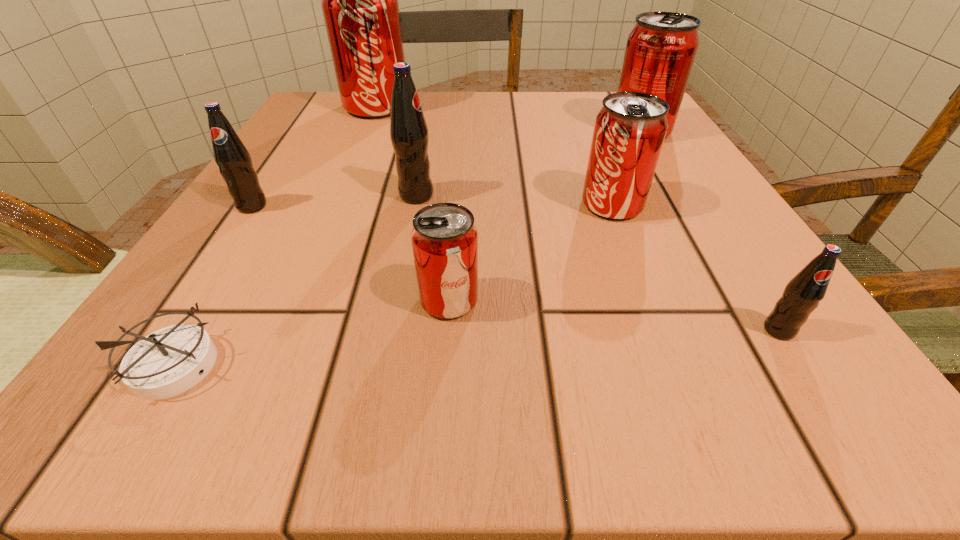
What are the coordinates of `free spot located 0.080m on the front label of the smallest black pop` in the screenshot? It's located at (828, 408).

Locate an element on the screen. free space located on the back of the compass is located at coordinates (249, 244).

I want to click on object present at the near edge, so click(169, 361).

Identify the location of compass that is at the left edge. The height and width of the screenshot is (540, 960). (169, 361).

Identify the location of object present at the far left corner. (359, 0).

Where is `object situated at the near left corner`? object situated at the near left corner is located at coordinates (169, 361).

I want to click on object positioned at the far right corner, so click(x=661, y=48).

Locate an element on the screen. The image size is (960, 540). vacant space at the far edge of the desktop is located at coordinates (526, 132).

Find the location of a particular element. The image size is (960, 540). free space at the near edge of the desktop is located at coordinates (608, 389).

In the image, there is a desktop. At what (x,y) coordinates should I click in order to perform the action: click on free space at the left edge. Please return your answer as a coordinate pair (x, y). This screenshot has width=960, height=540. Looking at the image, I should click on (314, 190).